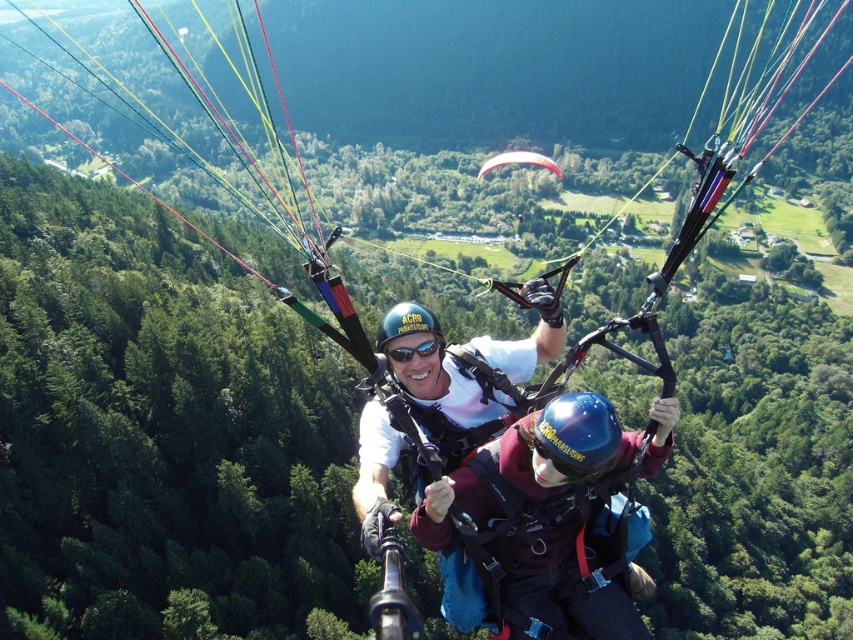
Question: Does maroon fleece jacket at center appear over red nylon parachute at center?

Choices:
 (A) no
 (B) yes

Answer: (A)

Question: Which of the following is the farthest from the observer?

Choices:
 (A) (527, 157)
 (B) (416, 346)
 (C) (585, 572)

Answer: (A)

Question: Does maroon fleece jacket at center have a lesser width compared to black matte goggles at center?

Choices:
 (A) no
 (B) yes

Answer: (A)

Question: Among these objects, which one is nearest to the camera?

Choices:
 (A) maroon fleece jacket at center
 (B) red nylon parachute at center
 (C) black matte goggles at center

Answer: (A)

Question: Is maroon fleece jacket at center above black matte goggles at center?

Choices:
 (A) yes
 (B) no

Answer: (B)

Question: Which object is positioned closest to the maroon fleece jacket at center?

Choices:
 (A) black matte goggles at center
 (B) red nylon parachute at center

Answer: (A)